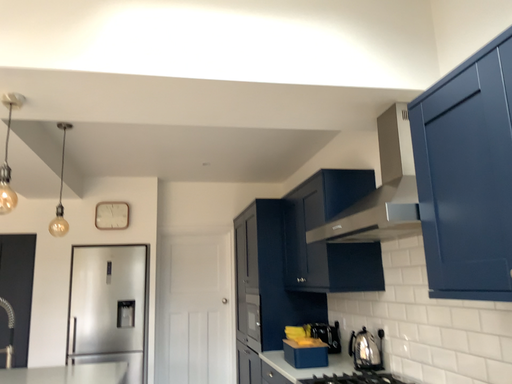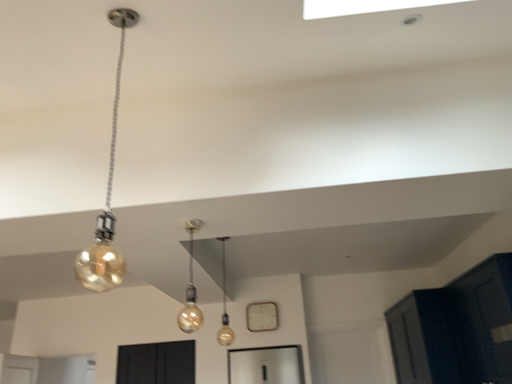
Question: How did the camera likely rotate when shooting the video?

Choices:
 (A) rotated upward
 (B) rotated downward

Answer: (A)